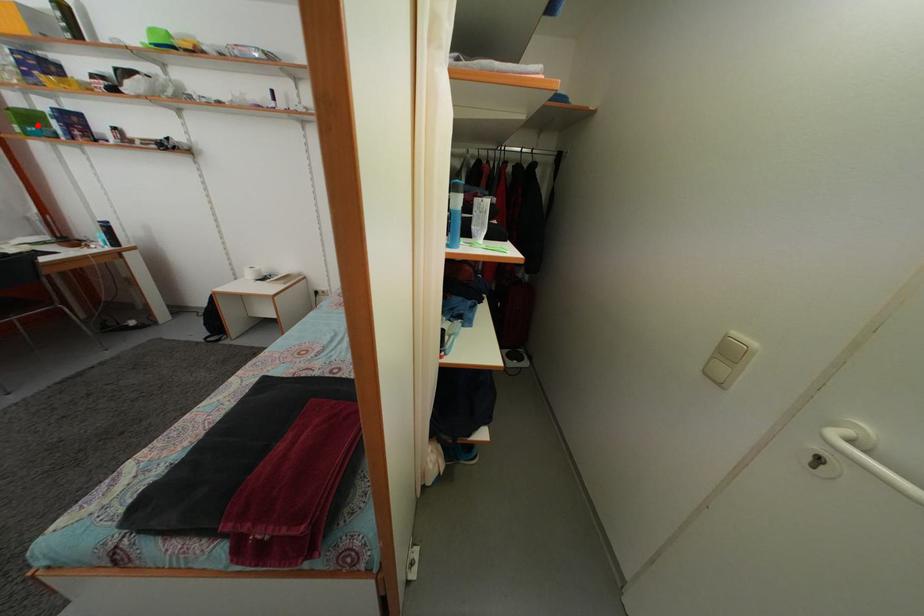
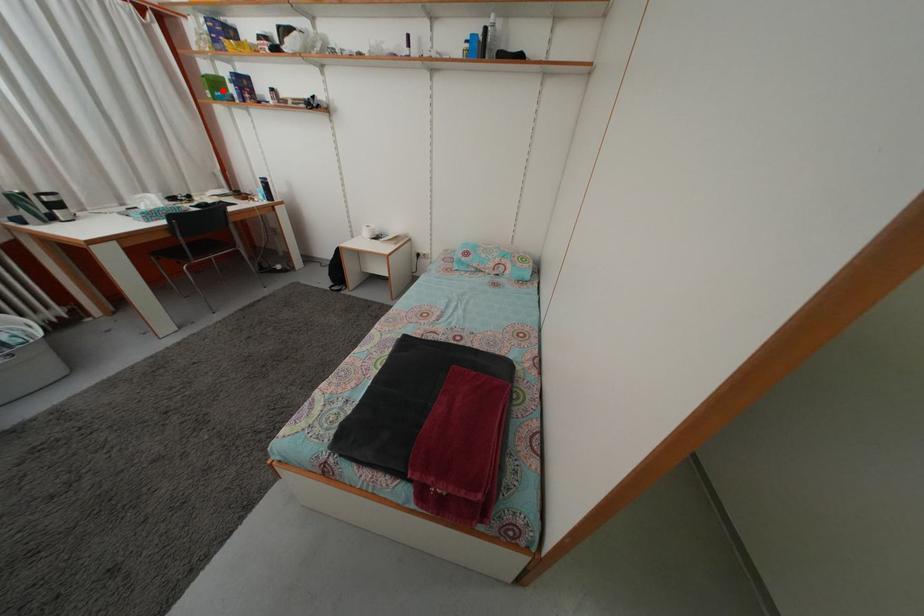
I am providing you with two images of the same scene from different viewpoints. A red point is marked on the first image and another point is marked on the second image. Does the point marked in image1 correspond to the same location as the one in image2?

Yes